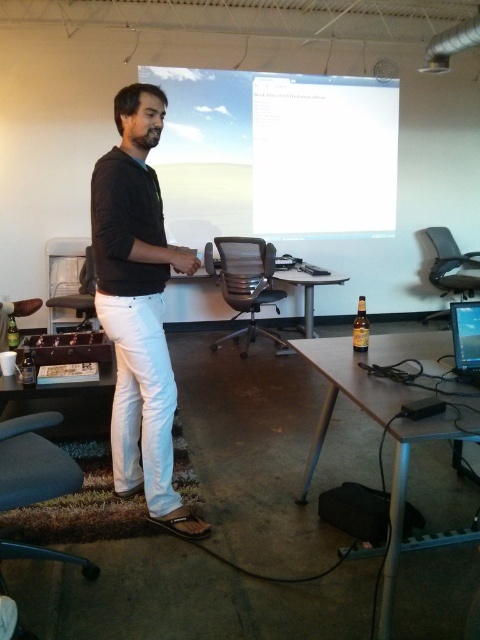
Does brown wood table at center lie behind matte black monitor at center?

Yes, it is.

Between brown wood table at center and matte black monitor at center, which one is positioned lower?

Positioned lower is matte black monitor at center.

Is point (304, 280) more distant than point (458, 333)?

Yes, it is behind point (458, 333).

Where is `brown wood table at center`? The image size is (480, 640). brown wood table at center is located at coordinates (193, 304).

Can you confirm if white glossy projection screen at upper center is wider than velvet grey swivel chair at lower left?

Yes, white glossy projection screen at upper center is wider than velvet grey swivel chair at lower left.

Does white glossy projection screen at upper center come in front of velvet grey swivel chair at lower left?

No, it is behind velvet grey swivel chair at lower left.

Is point (283, 129) farther from camera compared to point (50, 476)?

Yes, point (283, 129) is farther from viewer.

Locate an element on the screen. white glossy projection screen at upper center is located at coordinates (276, 154).

Does black matte shirt at center have a greater height compared to velvet grey swivel chair at lower left?

Indeed, black matte shirt at center has a greater height compared to velvet grey swivel chair at lower left.

Between black matte shirt at center and velvet grey swivel chair at lower left, which one appears on the right side from the viewer's perspective?

black matte shirt at center

Which is behind, point (136, 288) or point (44, 472)?

Positioned behind is point (136, 288).

Find the location of a particular element. This screenshot has width=480, height=640. black matte shirt at center is located at coordinates (139, 307).